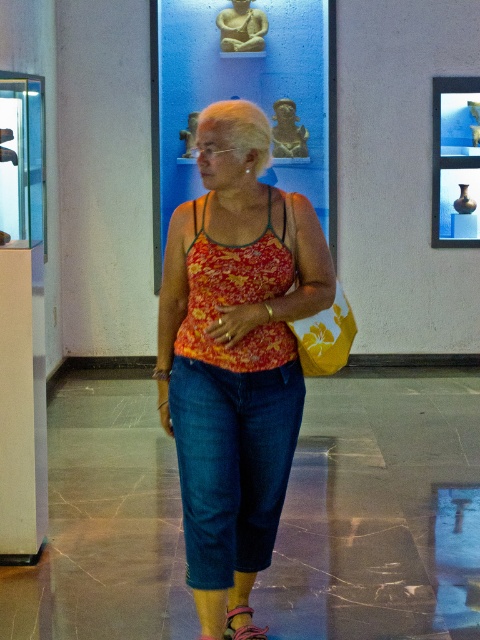
You are an AI analyzing the image of a woman in a museum. The coordinates point to an object. What is the object located at the coordinates point [233,355]?

The point [233,355] indicates the floral fabric tank top at center.

Where is the floral fabric tank top at center located in the image?

The floral fabric tank top at center is located at point (233,355) in the image.

In the scene shown: The woman in the image is wearing a floral fabric tank top at center and a leather sandal at lower center. Which item is closer to the viewer?

The floral fabric tank top at center is closer to the viewer since it is in front of the leather sandal at lower center.